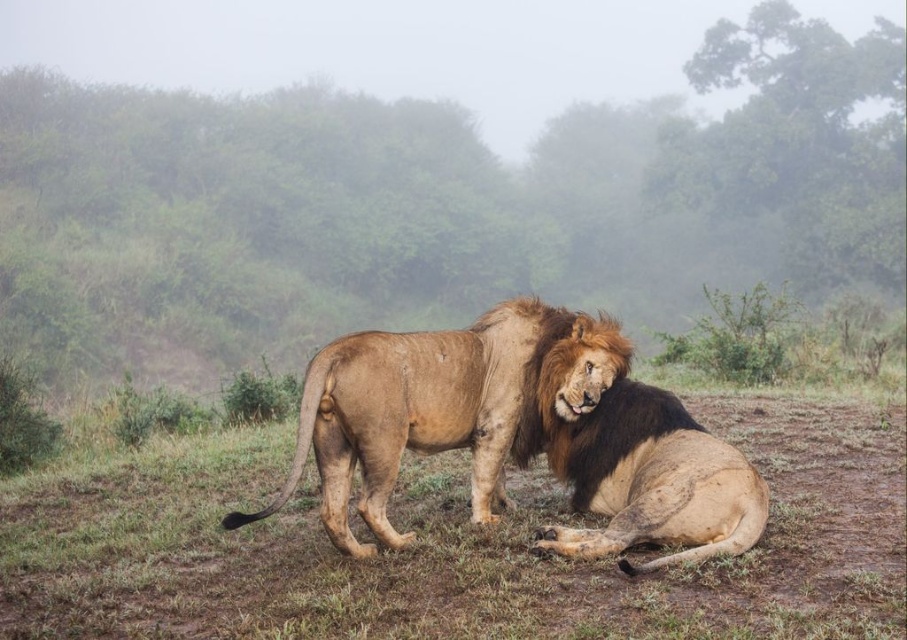
Question: Which of the following is the closest to the observer?

Choices:
 (A) fuzzy brown lion at center
 (B) brown shaggy lion at center

Answer: (A)

Question: Which point is farther from the camera taking this photo?

Choices:
 (A) (541, 435)
 (B) (294, 593)

Answer: (A)

Question: Does fuzzy brown lion at center appear over brown shaggy lion at center?

Choices:
 (A) no
 (B) yes

Answer: (A)

Question: Is fuzzy brown lion at center above brown shaggy lion at center?

Choices:
 (A) no
 (B) yes

Answer: (A)

Question: Can you confirm if fuzzy brown lion at center is positioned above brown shaggy lion at center?

Choices:
 (A) yes
 (B) no

Answer: (B)

Question: Which point appears closest to the camera in this image?

Choices:
 (A) (740, 586)
 (B) (363, 410)

Answer: (A)